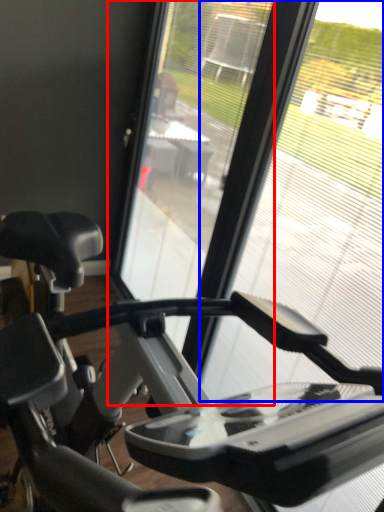
Question: Which point is closer to the camera, screen door (highlighted by a red box) or glass window (highlighted by a blue box)?

Choices:
 (A) screen door
 (B) glass window

Answer: (B)